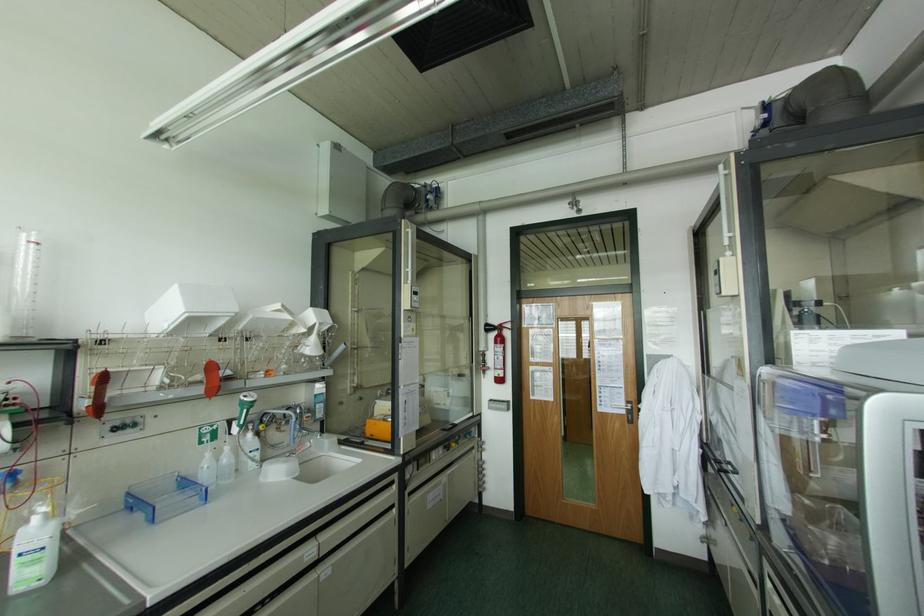
The height and width of the screenshot is (616, 924). I want to click on metal door handle, so (x=628, y=411).